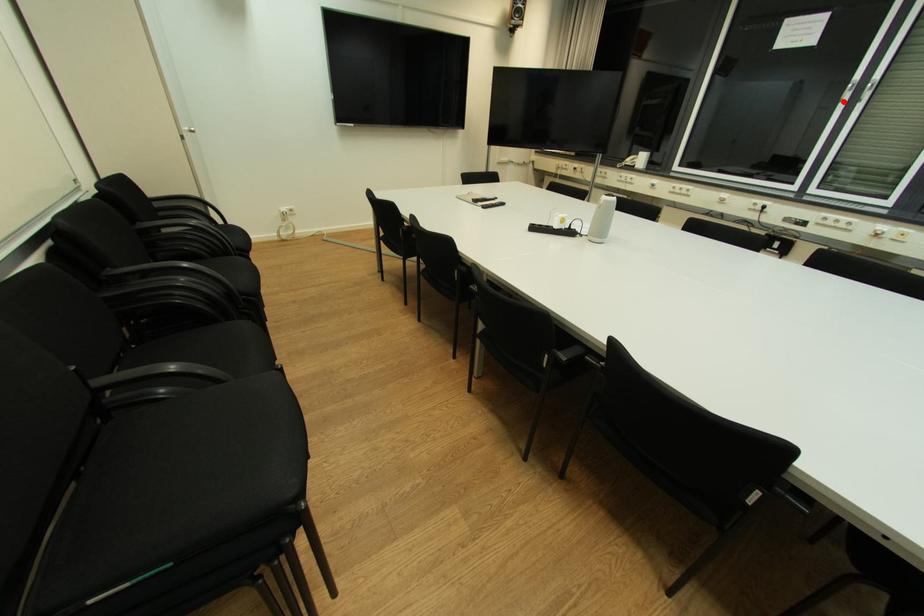
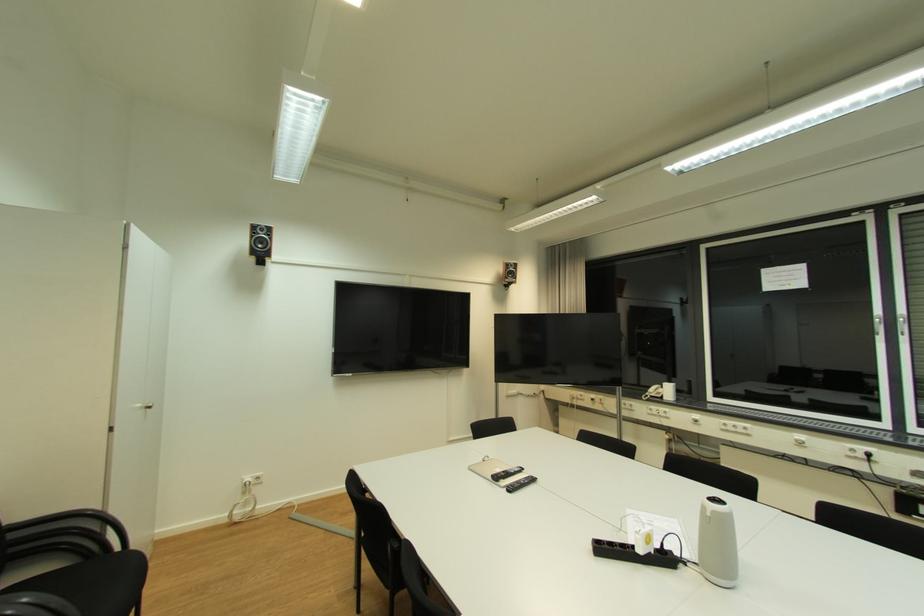
Question: I am providing you with two images of the same scene from different viewpoints. Given a red point in image1, look at the same physical point in image2. Is it:

Choices:
 (A) Closer to the viewpoint
 (B) Farther from the viewpoint

Answer: (A)